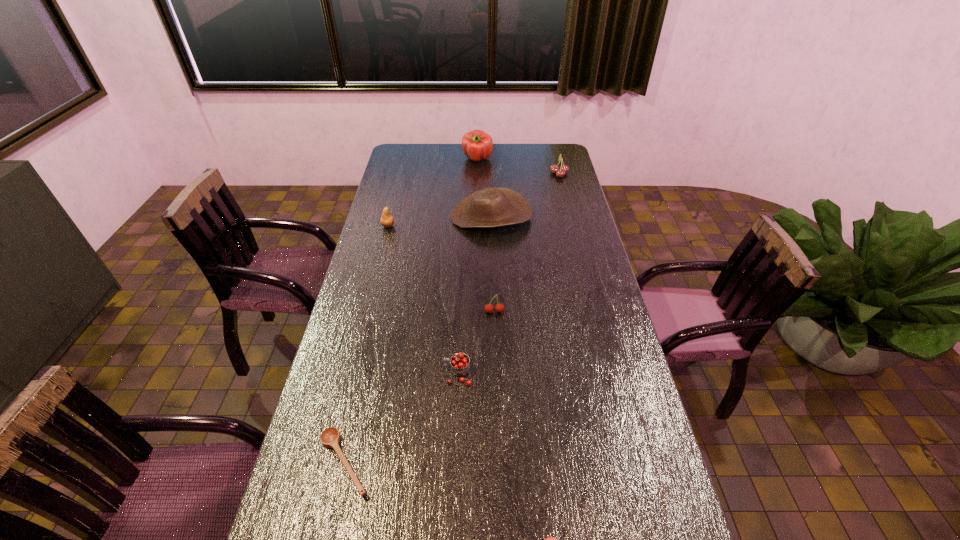
Locate an element on the screen. Image resolution: width=960 pixels, height=540 pixels. free space located 0.190m on the handle side of the leftmost cherry is located at coordinates (376, 374).

Locate an element on the screen. This screenshot has width=960, height=540. vacant space located on the surface of the fifth farthest object is located at coordinates (497, 402).

Where is `free space located 0.330m on the back of the wooden spoon`? This screenshot has height=540, width=960. free space located 0.330m on the back of the wooden spoon is located at coordinates (374, 333).

Image resolution: width=960 pixels, height=540 pixels. In order to click on object that is at the far edge in this screenshot , I will do `click(477, 145)`.

Find the location of a particular element. pear at the left edge is located at coordinates (387, 220).

At what (x,y) coordinates should I click in order to perform the action: click on wooden spoon that is at the left edge. Please return your answer as a coordinate pair (x, y). The image size is (960, 540). Looking at the image, I should click on (330, 437).

Find the location of a particular element. The image size is (960, 540). object that is positioned at the right edge is located at coordinates (560, 173).

You are a GUI agent. You are given a task and a screenshot of the screen. Output one action in this format:
    pyautogui.click(x=<x>, y=<y>)
    Task: Click on the vacant space at the far edge of the desktop
    The image size is (960, 540).
    Given the screenshot: What is the action you would take?
    pos(500,165)

Where is `vacant space at the left edge`? The height and width of the screenshot is (540, 960). vacant space at the left edge is located at coordinates (355, 278).

Locate an element on the screen. free space at the right edge of the desktop is located at coordinates (588, 232).